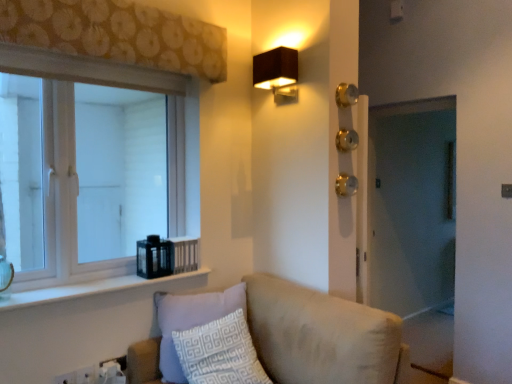
Question: From their relative heights in the image, would you say brown floral fabric at upper left is taller or shorter than beige fabric couch at lower center?

Choices:
 (A) tall
 (B) short

Answer: (B)

Question: Relative to beige fabric couch at lower center, is brown floral fabric at upper left in front or behind?

Choices:
 (A) front
 (B) behind

Answer: (B)

Question: Estimate the real-world distances between objects in this image. Which object is farther from the white wood window at left?

Choices:
 (A) brown floral fabric at upper left
 (B) gold metallic door handle at center-right
 (C) white plastic electric outlet at lower left, marked as the 2th electric outlet in a left-to-right arrangement
 (D) matte brown rectangular light fixture at upper right
 (E) white glossy window sill at lower left

Answer: (B)

Question: Considering the real-world distances, which object is closest to the white plastic electric outlet at lower left, positioned as the second electric outlet in right-to-left order?

Choices:
 (A) gold metallic door handle at center-right
 (B) beige fabric couch at lower center
 (C) brown floral fabric at upper left
 (D) white wood window at left
 (E) white plastic electric outlet at lower left, marked as the 2th electric outlet in a left-to-right arrangement

Answer: (E)